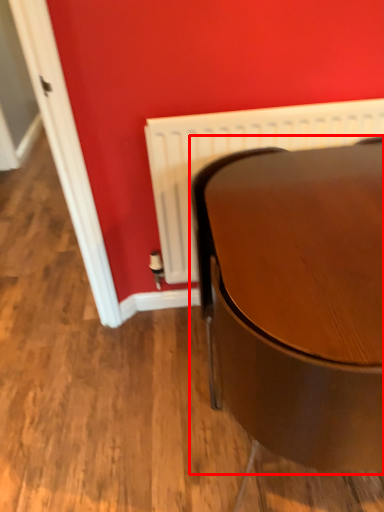
Question: From the image, what is the correct spatial relationship of table (annotated by the red box) in relation to radiator?

Choices:
 (A) right
 (B) left

Answer: (A)